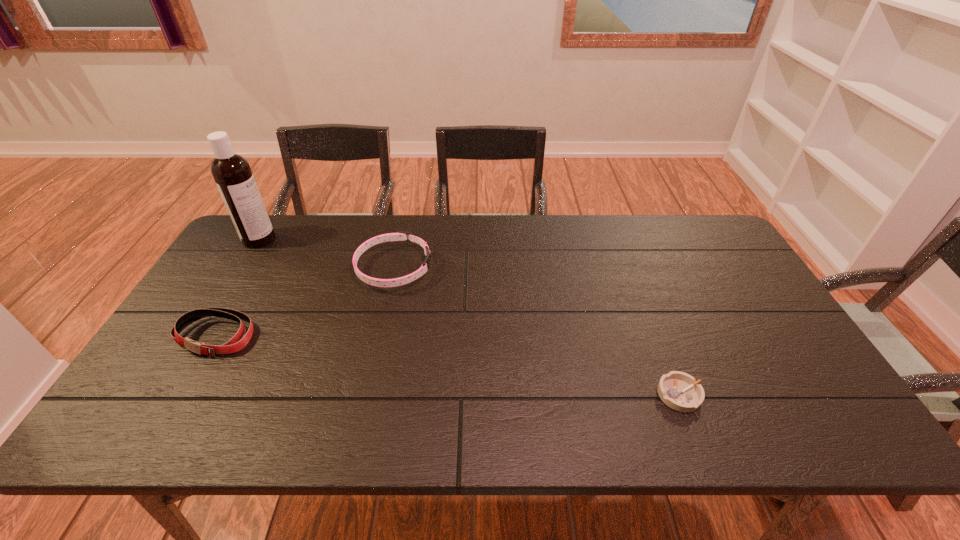
Find the location of a particular element. free space located 0.300m on the back of the ashtray is located at coordinates (639, 291).

Identify the location of dishwasher detergent that is positioned at the far edge. (232, 173).

Where is `dog collar that is at the far edge`? The image size is (960, 540). dog collar that is at the far edge is located at coordinates (400, 235).

Locate an element on the screen. object present at the near edge is located at coordinates (680, 391).

The height and width of the screenshot is (540, 960). In order to click on dishwasher detergent situated at the left edge in this screenshot , I will do [232, 173].

Locate an element on the screen. dog collar that is at the left edge is located at coordinates (236, 343).

You are a GUI agent. You are given a task and a screenshot of the screen. Output one action in this format:
    pyautogui.click(x=<x>, y=<y>)
    Task: Click on the object situated at the far left corner
    Image resolution: width=960 pixels, height=540 pixels.
    Given the screenshot: What is the action you would take?
    pyautogui.click(x=232, y=173)

Image resolution: width=960 pixels, height=540 pixels. Identify the location of free space at the far edge of the desktop. [x=445, y=240].

The height and width of the screenshot is (540, 960). Identify the location of free space at the near edge. tap(269, 431).

Where is `vacant space at the left edge of the desktop`? The height and width of the screenshot is (540, 960). vacant space at the left edge of the desktop is located at coordinates (235, 303).